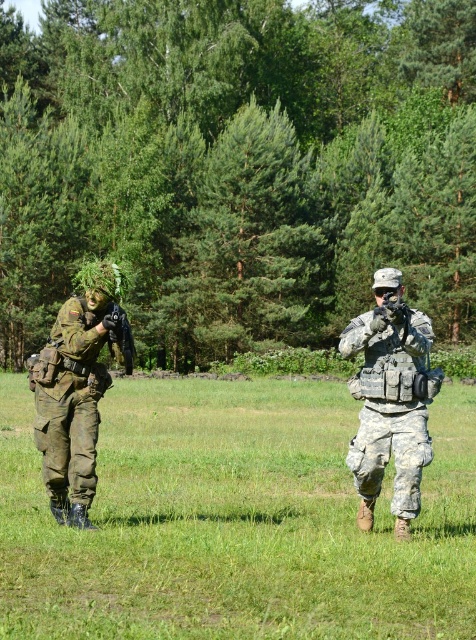
Does camouflage fabric pants at center have a smaller size compared to camouflage fabric helmet at left?

No.

Does camouflage fabric pants at center appear on the left side of camouflage fabric helmet at left?

In fact, camouflage fabric pants at center is to the right of camouflage fabric helmet at left.

Does point (331, 452) come farther from viewer compared to point (72, 476)?

That is True.

The image size is (476, 640). What are the coordinates of `camouflage fabric pants at center` in the screenshot? It's located at (235, 522).

Measure the distance from camouflage fabric pants at center to camouflage fabric uniform at center.

camouflage fabric pants at center and camouflage fabric uniform at center are 32.82 feet apart.

Between camouflage fabric pants at center and camouflage fabric uniform at center, which one is positioned higher?

camouflage fabric uniform at center

Where is `camouflage fabric pants at center`? camouflage fabric pants at center is located at coordinates click(x=235, y=522).

Based on the photo, is camouflage fabric helmet at left to the left of black matte rifle at center from the viewer's perspective?

Yes, camouflage fabric helmet at left is to the left of black matte rifle at center.

You are a GUI agent. You are given a task and a screenshot of the screen. Output one action in this format:
    pyautogui.click(x=<x>, y=<y>)
    Task: Click on the camouflage fabric helmet at left
    The width and height of the screenshot is (476, 640).
    Given the screenshot: What is the action you would take?
    pyautogui.click(x=77, y=388)

Find the location of a particular element. The image size is (476, 640). camouflage fabric helmet at left is located at coordinates (77, 388).